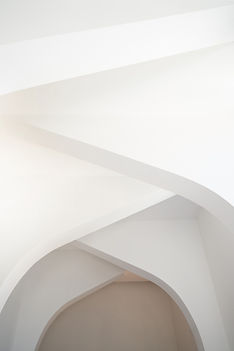
Identify the location of edge of second lowest shelf. (160, 285).